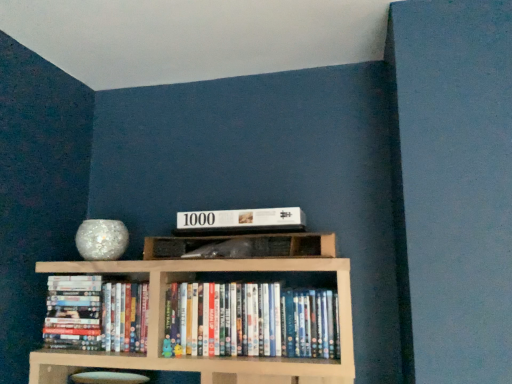
Question: Is white glossy dvd case at center, the first book when ordered from right to left, at the left side of white matte puzzle box at center?

Choices:
 (A) no
 (B) yes

Answer: (A)

Question: Could you tell me if white glossy dvd case at center, acting as the 2th book starting from the left, is facing white matte puzzle box at center?

Choices:
 (A) yes
 (B) no

Answer: (B)

Question: Is white matte puzzle box at center inside white glossy dvd case at center, the first book when ordered from right to left?

Choices:
 (A) yes
 (B) no

Answer: (B)

Question: From a real-world perspective, does white glossy dvd case at center, acting as the 2th book starting from the left, sit lower than white matte puzzle box at center?

Choices:
 (A) no
 (B) yes

Answer: (B)

Question: Is white glossy dvd case at center, acting as the 2th book starting from the left, facing away from white matte puzzle box at center?

Choices:
 (A) no
 (B) yes

Answer: (A)

Question: Can you confirm if white glossy dvd case at center, the first book when ordered from right to left, is shorter than white matte puzzle box at center?

Choices:
 (A) yes
 (B) no

Answer: (B)

Question: Considering the relative sizes of white matte puzzle box at center and hardcover books at center, placed as the 1th book when sorted from left to right, in the image provided, is white matte puzzle box at center taller than hardcover books at center, placed as the 1th book when sorted from left to right,?

Choices:
 (A) no
 (B) yes

Answer: (A)

Question: Could you tell me if white matte puzzle box at center is turned towards hardcover books at center, placed as the 1th book when sorted from left to right?

Choices:
 (A) no
 (B) yes

Answer: (A)

Question: From a real-world perspective, is white matte puzzle box at center beneath hardcover books at center, acting as the 2th book starting from the right?

Choices:
 (A) yes
 (B) no

Answer: (B)

Question: From the image's perspective, is white matte puzzle box at center beneath hardcover books at center, acting as the 2th book starting from the right?

Choices:
 (A) no
 (B) yes

Answer: (A)

Question: Is the depth of white matte puzzle box at center greater than that of hardcover books at center, placed as the 1th book when sorted from left to right?

Choices:
 (A) no
 (B) yes

Answer: (A)

Question: Does white matte puzzle box at center have a smaller size compared to hardcover books at center, placed as the 1th book when sorted from left to right?

Choices:
 (A) yes
 (B) no

Answer: (A)

Question: Considering the relative sizes of wooden shelf at center and white matte puzzle box at center in the image provided, is wooden shelf at center shorter than white matte puzzle box at center?

Choices:
 (A) yes
 (B) no

Answer: (B)